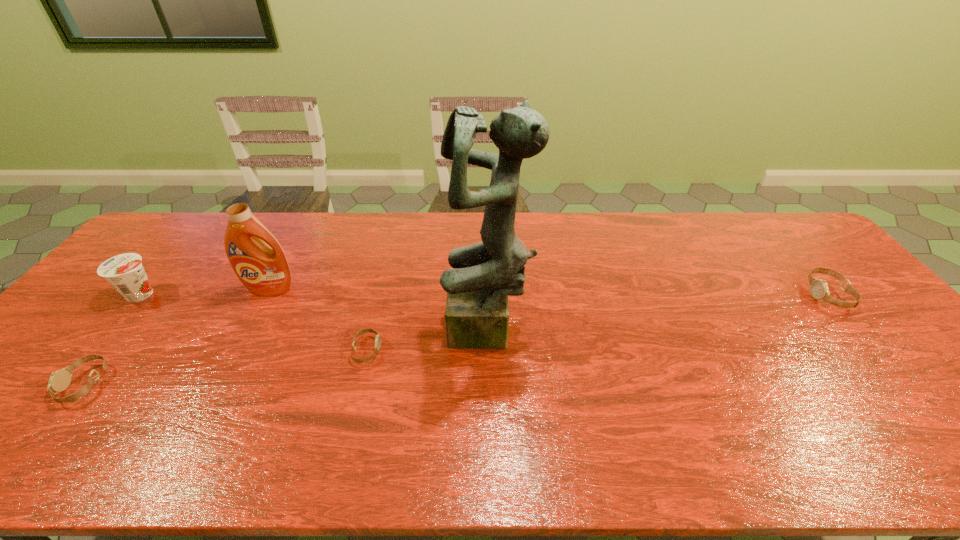
In order to click on yogurt in this screenshot , I will do (x=125, y=272).

The height and width of the screenshot is (540, 960). I want to click on blank space located 0.110m on the face of the fifth tallest object, so click(20, 384).

Locate an element on the screen. vacant position located 0.080m on the face of the fifth tallest object is located at coordinates (33, 384).

Identify the location of vacant position located 0.050m on the face of the fifth tallest object. This screenshot has height=540, width=960. (46, 384).

Locate an element on the screen. Image resolution: width=960 pixels, height=540 pixels. vacant space located on the face of the shortest object is located at coordinates (510, 350).

You are a GUI agent. You are given a task and a screenshot of the screen. Output one action in this format:
    pyautogui.click(x=<x>, y=<y>)
    Task: Click on the free space located on the face of the farthest watch
    Image resolution: width=960 pixels, height=540 pixels.
    Given the screenshot: What is the action you would take?
    pyautogui.click(x=737, y=295)

Find the location of a particular element. vacant region located on the face of the farthest watch is located at coordinates [707, 295].

Locate an element on the screen. The image size is (960, 540). vacant space located 0.180m on the face of the farthest watch is located at coordinates (748, 295).

Find the location of a particular element. This screenshot has height=540, width=960. free space located on the front-facing side of the detergent is located at coordinates (212, 398).

Locate an element on the screen. The image size is (960, 540). free point located on the face of the tallest object is located at coordinates (381, 333).